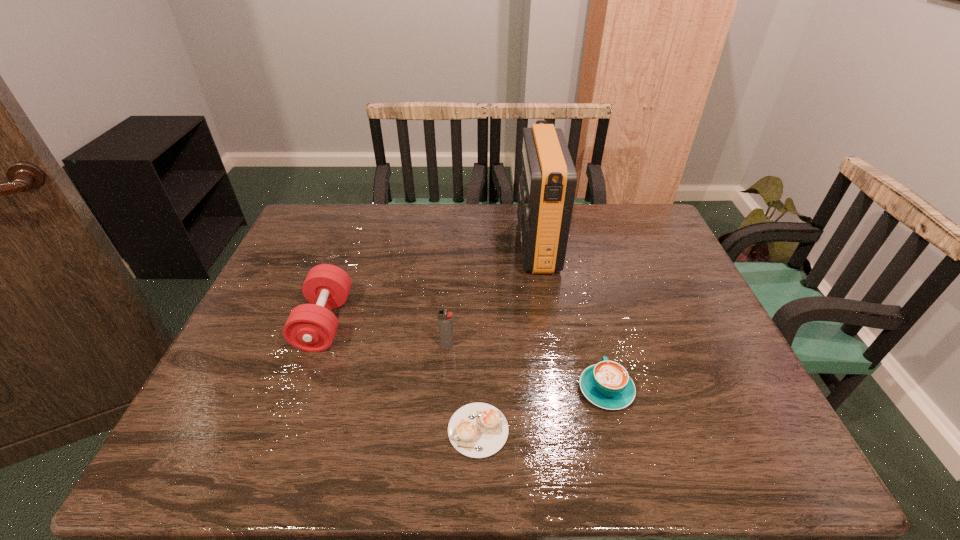
Identify the location of empty location between the fourth tallest object and the igniter. (527, 368).

Locate an element on the screen. The width and height of the screenshot is (960, 540). vacant space in between the left cappuccino and the igniter is located at coordinates (463, 388).

The image size is (960, 540). Find the location of `free point between the farthest object and the fourth tallest object`. free point between the farthest object and the fourth tallest object is located at coordinates (571, 318).

Find the location of `free point between the igniter and the right cappuccino`. free point between the igniter and the right cappuccino is located at coordinates (527, 368).

The height and width of the screenshot is (540, 960). I want to click on vacant area between the leftmost object and the right cappuccino, so click(x=466, y=356).

This screenshot has width=960, height=540. In order to click on object that can be found as the fourth closest to the taller cappuccino in this screenshot , I will do `click(312, 327)`.

Locate which object ranks second in proximity to the radio receiver. Please provide its 2D coordinates. Your answer should be formatted as a tuple, i.e. [(x, y)], where the tuple contains the x and y coordinates of a point satisfying the conditions above.

[(606, 384)]

The height and width of the screenshot is (540, 960). Find the location of `vacant space that satisfies the following two spatial constraints: 1. on the front side of the igniter; 2. on the left side of the left cappuccino`. vacant space that satisfies the following two spatial constraints: 1. on the front side of the igniter; 2. on the left side of the left cappuccino is located at coordinates (441, 430).

This screenshot has height=540, width=960. I want to click on free region that satisfies the following two spatial constraints: 1. on the front-facing side of the radio receiver; 2. on the front side of the left cappuccino, so click(566, 430).